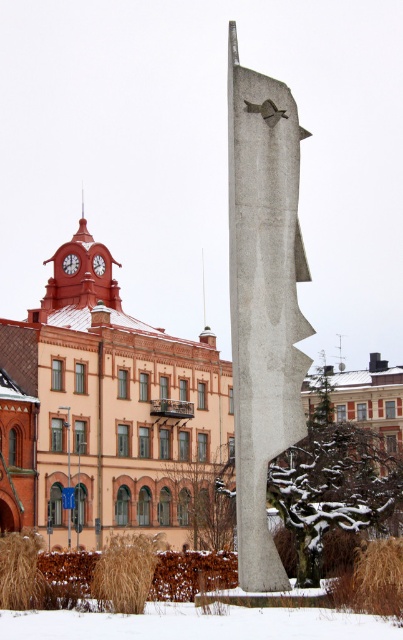
Question: Observing the image, what is the correct spatial positioning of brown grass at lower center in reference to brown grass at lower left?

Choices:
 (A) right
 (B) left

Answer: (A)

Question: Considering the relative positions of brown grass at lower left and red painted metal clock at center in the image provided, where is brown grass at lower left located with respect to red painted metal clock at center?

Choices:
 (A) right
 (B) left

Answer: (A)

Question: Based on their relative distances, which object is farther from the gray concrete sculpture at center?

Choices:
 (A) brown grass at lower center
 (B) red painted metal clock at center

Answer: (B)

Question: Among these points, which one is farthest from the camera?

Choices:
 (A) (363, 564)
 (B) (135, 552)
 (C) (78, 260)

Answer: (C)

Question: Can you confirm if brown grass at lower right is positioned above brown grass at lower center?

Choices:
 (A) no
 (B) yes

Answer: (B)

Question: Estimate the real-world distances between objects in this image. Which object is closer to the brown grass at lower right?

Choices:
 (A) gray concrete sculpture at center
 (B) brown grass at lower left
 (C) brown grass at lower center
 (D) red painted metal clock at center

Answer: (C)